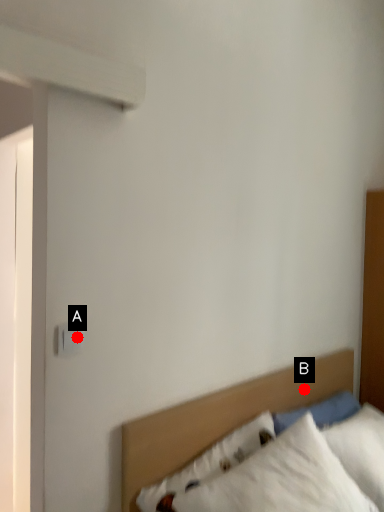
Question: Two points are circled on the image, labeled by A and B beside each circle. Which point appears farthest from the camera in this image?

Choices:
 (A) A is further
 (B) B is further

Answer: (B)